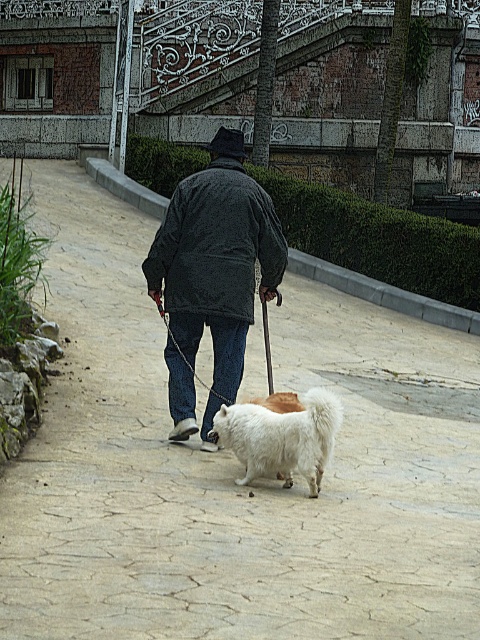
Who is shorter, dark gray fleece jacket at center or white fluffy dog at center?

Standing shorter between the two is white fluffy dog at center.

Is the position of dark gray fleece jacket at center more distant than that of white fluffy dog at center?

Yes, it is behind white fluffy dog at center.

Who is more forward, (203,196) or (288,416)?

Positioned in front is point (288,416).

At what (x,y) coordinates should I click in order to perform the action: click on dark gray fleece jacket at center. Please return your answer as a coordinate pair (x, y). Image resolution: width=480 pixels, height=640 pixels. Looking at the image, I should click on (216, 243).